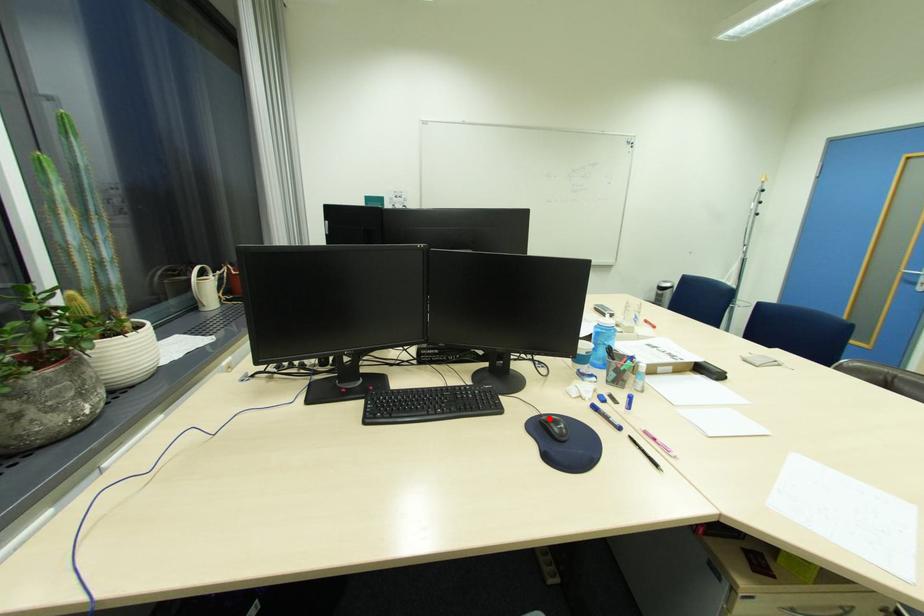
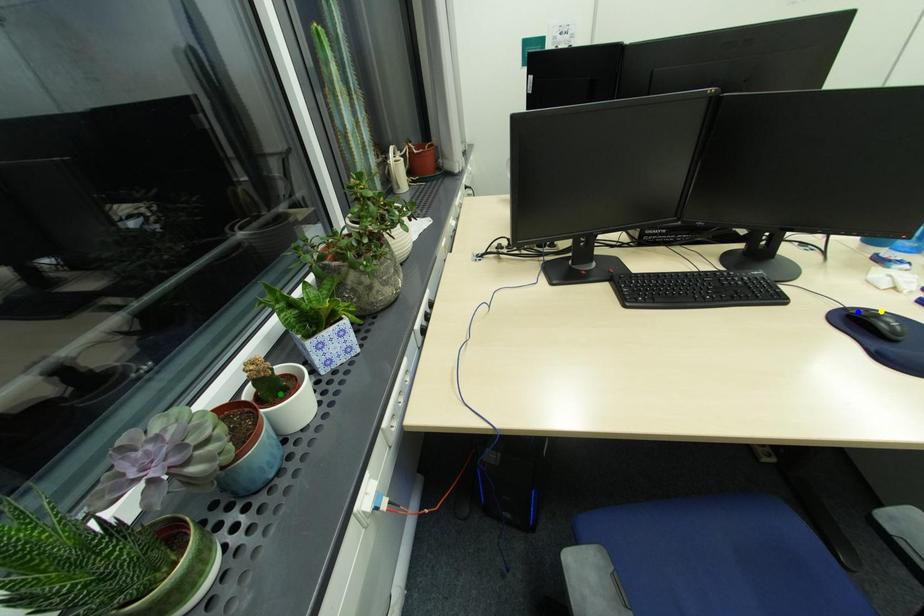
Question: I am providing you with two images of the same scene from different viewpoints. A red point is marked on the first image. You are given multiple points on the second image. Which point in image 2 is actually the same real-world point as the red point in image 1?

Choices:
 (A) green point
 (B) yellow point
 (C) blue point

Answer: (C)